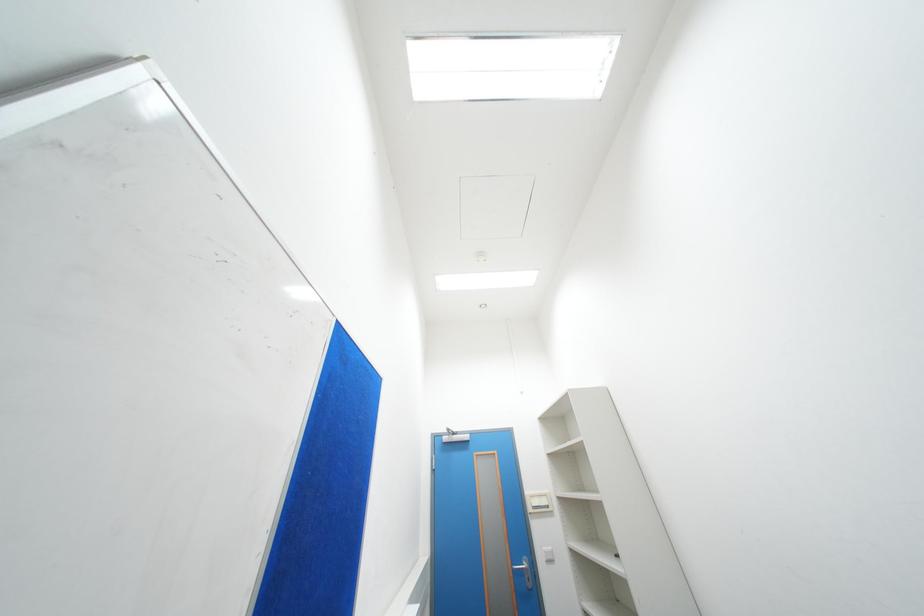
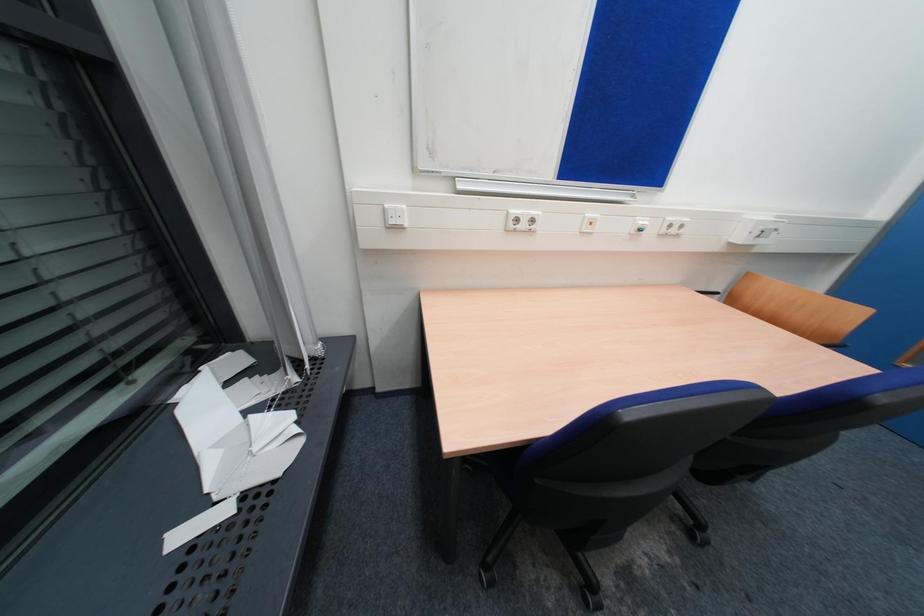
How did the camera likely rotate?

The camera rotated toward left-down.